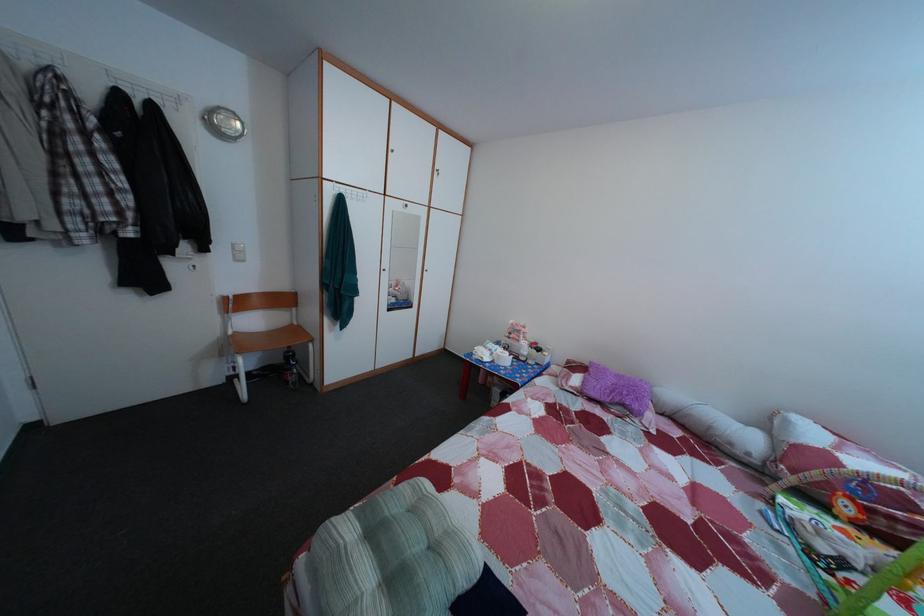
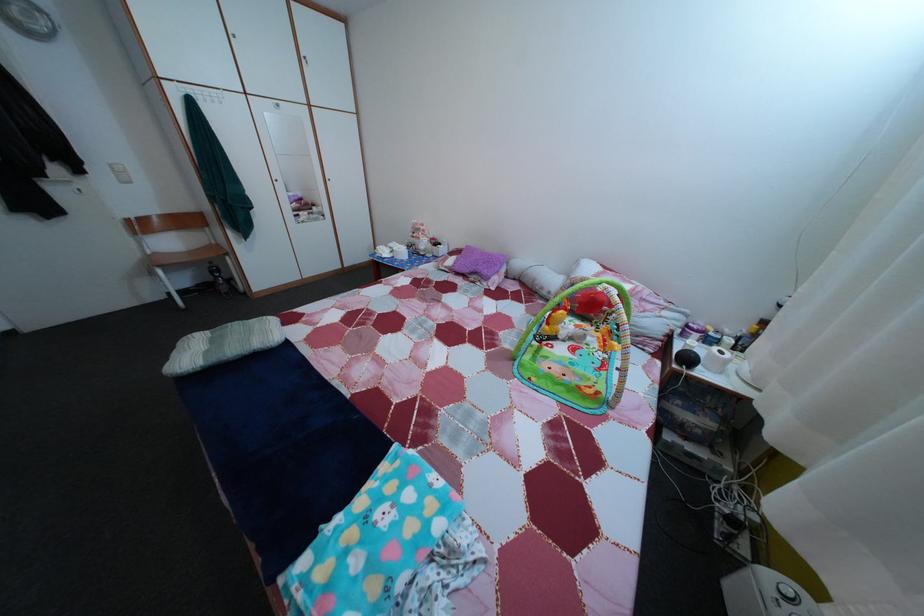
Locate, in the second image, the point that corresponds to pixel 244 257 in the first image.

(123, 177)